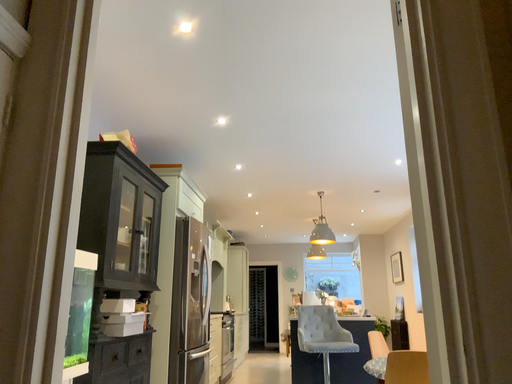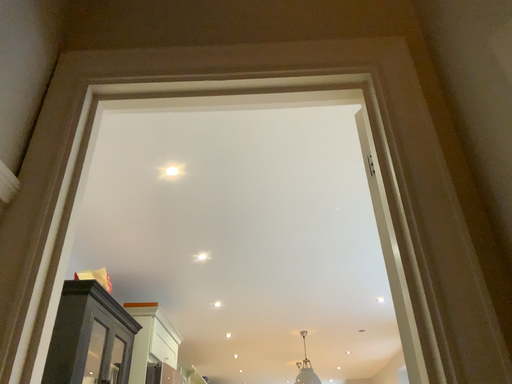
Question: How did the camera likely rotate when shooting the video?

Choices:
 (A) rotated downward
 (B) rotated upward

Answer: (B)